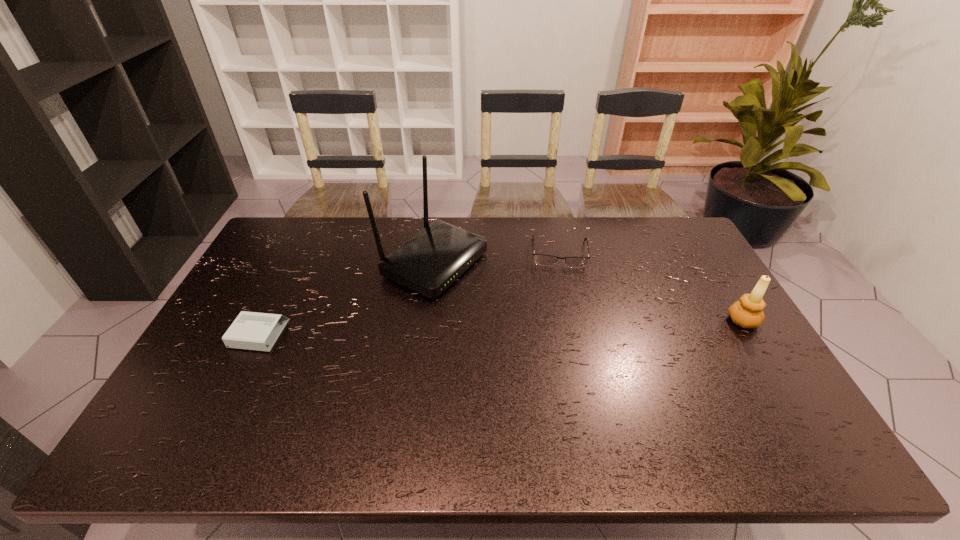
Find the location of a particular element. the leftmost object is located at coordinates (250, 330).

The height and width of the screenshot is (540, 960). Identify the location of the third shortest object. (747, 312).

Where is `the rightmost object`? This screenshot has height=540, width=960. the rightmost object is located at coordinates (747, 312).

I want to click on router, so click(428, 263).

What are the coordinates of `the tallest object` in the screenshot? It's located at [x=428, y=263].

At what (x,y) coordinates should I click in order to perform the action: click on the second object from right to left. Please return your answer as a coordinate pair (x, y). This screenshot has height=540, width=960. Looking at the image, I should click on (545, 260).

You are a GUI agent. You are given a task and a screenshot of the screen. Output one action in this format:
    pyautogui.click(x=<x>, y=<y>)
    Task: Click on the blank area located on the front of the alarm clock
    The image size is (960, 540).
    Given the screenshot: What is the action you would take?
    pyautogui.click(x=229, y=394)

The width and height of the screenshot is (960, 540). I want to click on vacant position located 0.200m on the front of the rightmost object, so click(x=787, y=393).

Where is `free location located 0.060m on the front-facing side of the tallest object`? Image resolution: width=960 pixels, height=540 pixels. free location located 0.060m on the front-facing side of the tallest object is located at coordinates (494, 291).

Find the location of a particular element. The width and height of the screenshot is (960, 540). blank area located on the front-facing side of the tallest object is located at coordinates (516, 301).